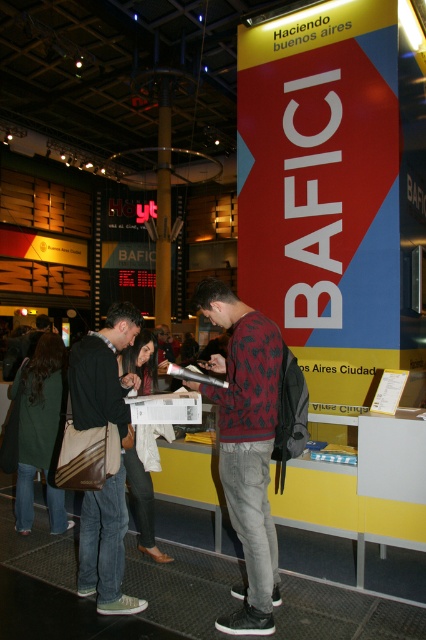
Does red patterned sweater at center have a larger size compared to dark green jacket at lower left?

Yes, red patterned sweater at center is bigger than dark green jacket at lower left.

Is red patterned sweater at center further to camera compared to dark green jacket at lower left?

That is False.

Which is in front, point (252, 534) or point (19, 452)?

Point (252, 534)

I want to click on red patterned sweater at center, so click(x=245, y=445).

Can you confirm if dark green jacket at lower left is thinner than white cotton shirt at center?

Incorrect, dark green jacket at lower left's width is not less than white cotton shirt at center's.

Is dark green jacket at lower left wider than white cotton shirt at center?

Yes.

The height and width of the screenshot is (640, 426). Find the location of `dark green jacket at lower left`. dark green jacket at lower left is located at coordinates tap(40, 429).

This screenshot has height=640, width=426. In order to click on red patterned sweater at center in this screenshot , I will do `click(245, 445)`.

Can you confirm if red patterned sweater at center is taller than khaki canvas bag at center?

Yes.

This screenshot has width=426, height=640. What are the coordinates of `red patterned sweater at center` in the screenshot? It's located at (245, 445).